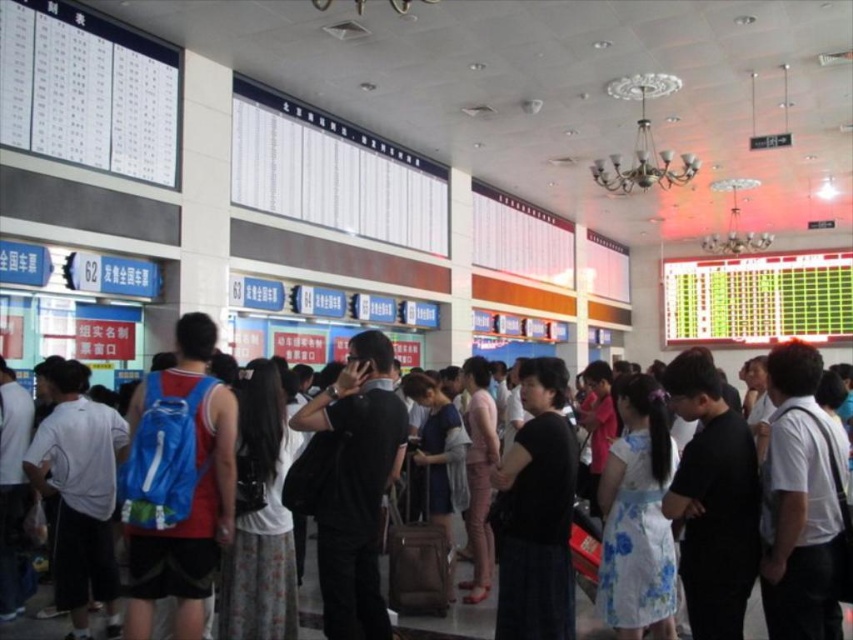
This screenshot has height=640, width=853. What do you see at coordinates (537, 512) in the screenshot?
I see `black matte dress at center` at bounding box center [537, 512].

Which is above, black matte dress at center or white floral dress at center?

white floral dress at center is higher up.

Image resolution: width=853 pixels, height=640 pixels. I want to click on black matte dress at center, so click(x=537, y=512).

Identify the location of black matte dress at center. (x=537, y=512).

Which is behind, point (107, 552) or point (598, 570)?

Point (107, 552)

Which is more to the right, white matte backpack at left or white floral dress at center?

white floral dress at center is more to the right.

The height and width of the screenshot is (640, 853). What are the coordinates of `white matte backpack at left` in the screenshot? It's located at pyautogui.click(x=80, y=493).

The image size is (853, 640). I want to click on white matte backpack at left, so click(x=80, y=493).

Who is positioned more to the right, white floral dress at center or pink fabric pants at center?

Positioned to the right is white floral dress at center.

Can you confirm if white floral dress at center is positioned to the right of pink fabric pants at center?

Indeed, white floral dress at center is positioned on the right side of pink fabric pants at center.

Where is `white floral dress at center`? white floral dress at center is located at coordinates (637, 516).